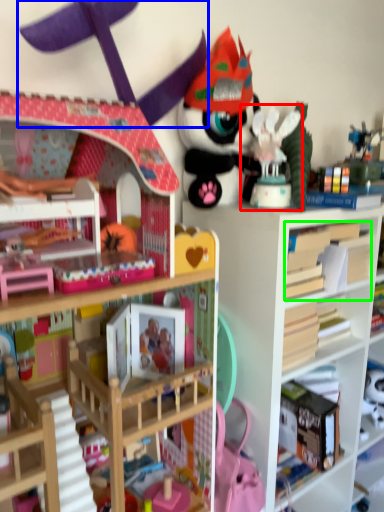
Question: Which is farther away from toy (highlighted by a red box)? toy (highlighted by a blue box) or book (highlighted by a green box)?

Choices:
 (A) toy
 (B) book

Answer: (A)